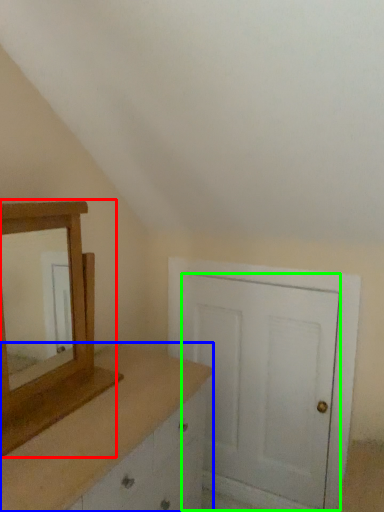
Question: Which is farther away from medicine cabinet (highlighted by a red box)? chest of drawers (highlighted by a blue box) or door (highlighted by a green box)?

Choices:
 (A) chest of drawers
 (B) door

Answer: (B)